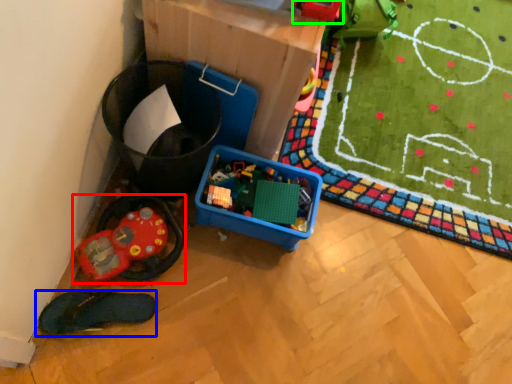
Question: Which object is positioned closest to toy (highlighted by a red box)? Select from footwear (highlighted by a blue box) and toy (highlighted by a green box).

Choices:
 (A) footwear
 (B) toy

Answer: (A)